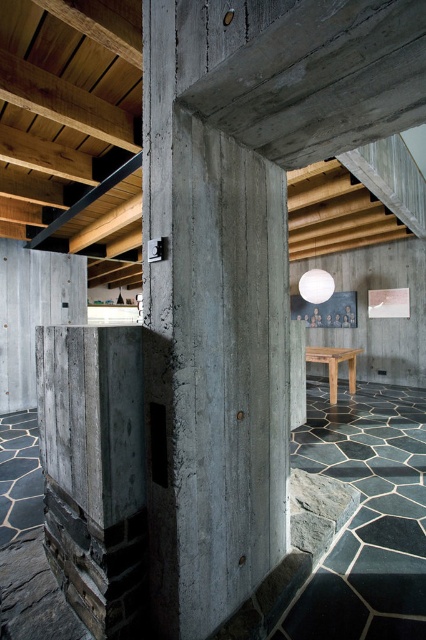
Does black metal beam at upper left appear under wooden stool at center?

Incorrect, black metal beam at upper left is not positioned below wooden stool at center.

Between point (123, 177) and point (347, 355), which one is positioned behind?

Positioned behind is point (347, 355).

This screenshot has height=640, width=426. Identify the location of black metal beam at upper left. (86, 198).

Between concrete at center and wooden stool at center, which one has more height?

concrete at center

Is point (250, 326) closer to viewer compared to point (331, 396)?

That is True.

Where is `concrete at center`? concrete at center is located at coordinates (210, 326).

Does black metal beam at upper left come in front of white matte sphere at upper center?

Yes, it is.

Can you confirm if black metal beam at upper left is positioned above white matte sphere at upper center?

Correct, black metal beam at upper left is located above white matte sphere at upper center.

Image resolution: width=426 pixels, height=640 pixels. What are the coordinates of `black metal beam at upper left` in the screenshot? It's located at (86, 198).

The height and width of the screenshot is (640, 426). In order to click on black metal beam at upper left in this screenshot , I will do `click(86, 198)`.